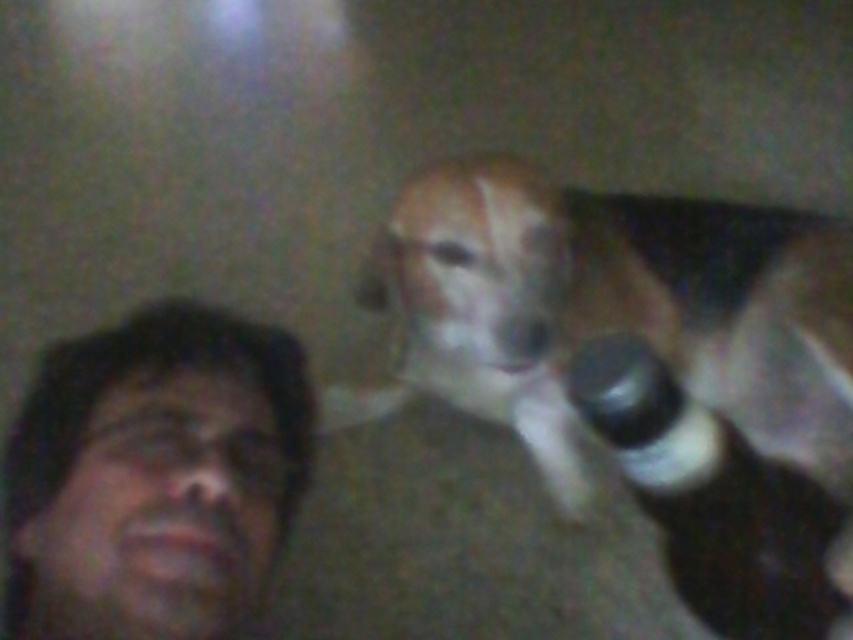
Consider the image. Does brown fur dog at upper right appear on the left side of matte black hair at left?

In fact, brown fur dog at upper right is to the right of matte black hair at left.

Identify the location of brown fur dog at upper right. This screenshot has width=853, height=640. (641, 365).

Can you confirm if matte black hair at left is positioned to the left of black plastic bottle at upper right?

Indeed, matte black hair at left is positioned on the left side of black plastic bottle at upper right.

What do you see at coordinates (154, 476) in the screenshot? This screenshot has width=853, height=640. I see `matte black hair at left` at bounding box center [154, 476].

Between point (181, 493) and point (811, 541), which one is positioned behind?

The point (811, 541) is behind.

At what (x,y) coordinates should I click in order to perform the action: click on matte black hair at left. Please return your answer as a coordinate pair (x, y). The height and width of the screenshot is (640, 853). Looking at the image, I should click on (154, 476).

The image size is (853, 640). I want to click on brown fur dog at upper right, so click(641, 365).

Is point (814, 298) behind point (695, 468)?

Yes, it is behind point (695, 468).

At what (x,y) coordinates should I click in order to perform the action: click on brown fur dog at upper right. Please return your answer as a coordinate pair (x, y). The image size is (853, 640). Looking at the image, I should click on pyautogui.click(x=641, y=365).